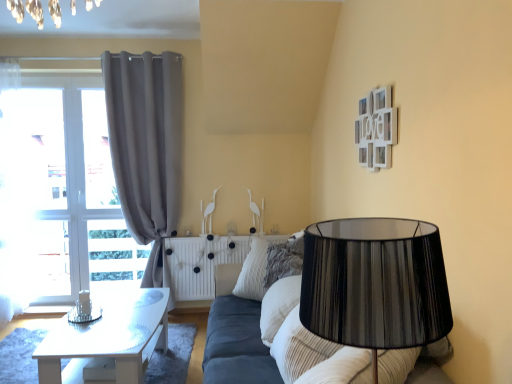
Question: Is black pleated lampshade at center next to white textured radiator at center?

Choices:
 (A) yes
 (B) no

Answer: (B)

Question: Does black pleated lampshade at center have a greater height compared to white textured radiator at center?

Choices:
 (A) yes
 (B) no

Answer: (B)

Question: Is black pleated lampshade at center shorter than white textured radiator at center?

Choices:
 (A) yes
 (B) no

Answer: (A)

Question: Can you confirm if black pleated lampshade at center is wider than white textured radiator at center?

Choices:
 (A) yes
 (B) no

Answer: (A)

Question: From the image's perspective, is black pleated lampshade at center located above white textured radiator at center?

Choices:
 (A) no
 (B) yes

Answer: (B)

Question: Is black pleated lampshade at center outside white textured radiator at center?

Choices:
 (A) no
 (B) yes

Answer: (B)

Question: From a real-world perspective, is white textured radiator at center physically below striped fabric pillow at center?

Choices:
 (A) no
 (B) yes

Answer: (B)

Question: Would you consider white textured radiator at center to be distant from striped fabric pillow at center?

Choices:
 (A) no
 (B) yes

Answer: (A)

Question: Is white textured radiator at center bigger than striped fabric pillow at center?

Choices:
 (A) yes
 (B) no

Answer: (A)

Question: Can you confirm if white textured radiator at center is smaller than striped fabric pillow at center?

Choices:
 (A) yes
 (B) no

Answer: (B)

Question: Are white textured radiator at center and striped fabric pillow at center making contact?

Choices:
 (A) yes
 (B) no

Answer: (B)

Question: Would you say white textured radiator at center is outside striped fabric pillow at center?

Choices:
 (A) yes
 (B) no

Answer: (A)

Question: Is striped fabric pillow at center located outside white glossy table at left?

Choices:
 (A) no
 (B) yes

Answer: (B)